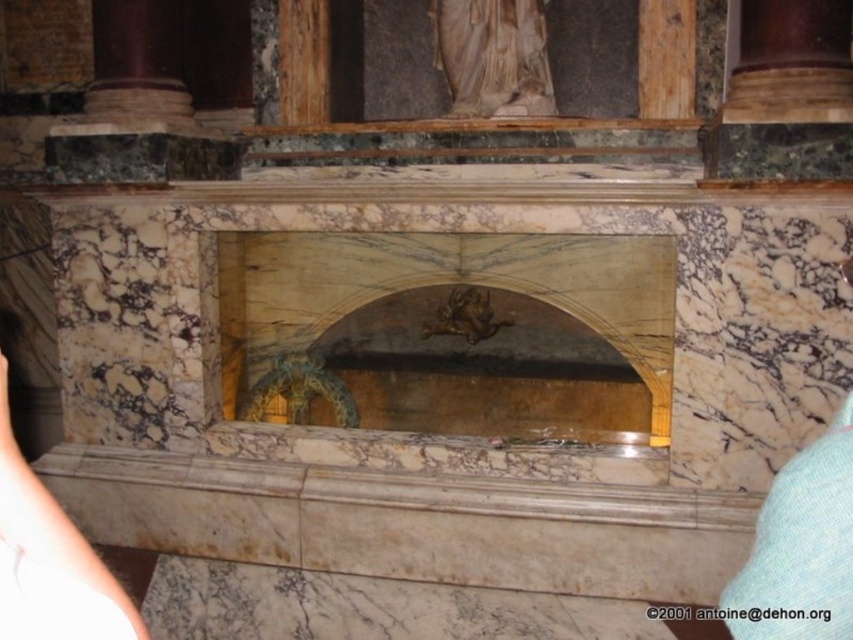
Can you confirm if marble fireplace at center is taller than gold metallic sculpture at center?

Yes, marble fireplace at center is taller than gold metallic sculpture at center.

Find the location of a particular element. marble fireplace at center is located at coordinates (445, 346).

Who is positioned more to the right, white marble statue at upper center or gold metallic sculpture at center?

white marble statue at upper center

Who is more distant from viewer, (505, 44) or (457, 310)?

The point (505, 44) is behind.

This screenshot has width=853, height=640. Identify the location of white marble statue at upper center. (492, 56).

Measure the distance between point [482,113] and camera.

Point [482,113] is 10.94 meters from camera.

Can you confirm if white marble statue at upper center is wider than skinny white arm at lower left?

Indeed, white marble statue at upper center has a greater width compared to skinny white arm at lower left.

From the picture: Who is more forward, (488, 90) or (4, 428)?

Point (4, 428) is more forward.

The height and width of the screenshot is (640, 853). Identify the location of white marble statue at upper center. (492, 56).